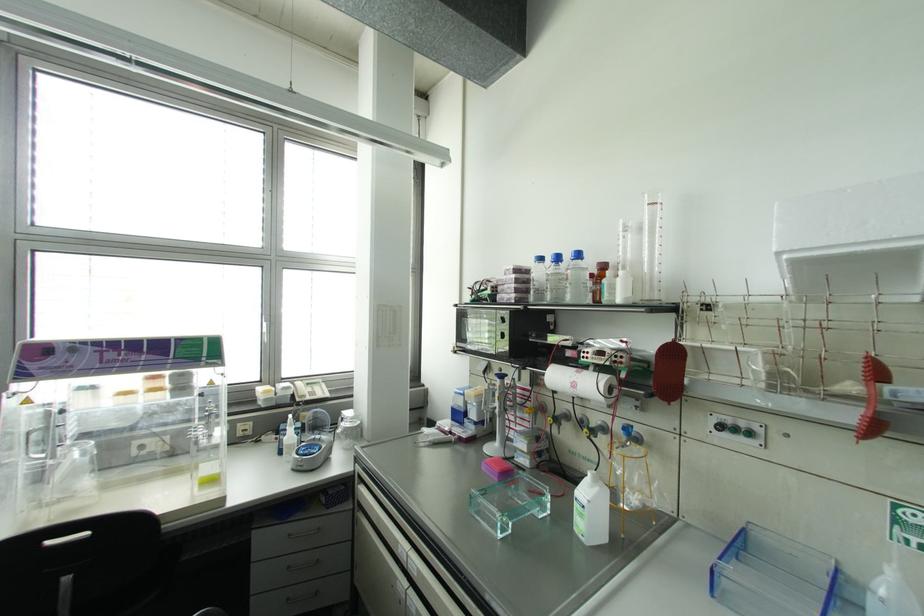
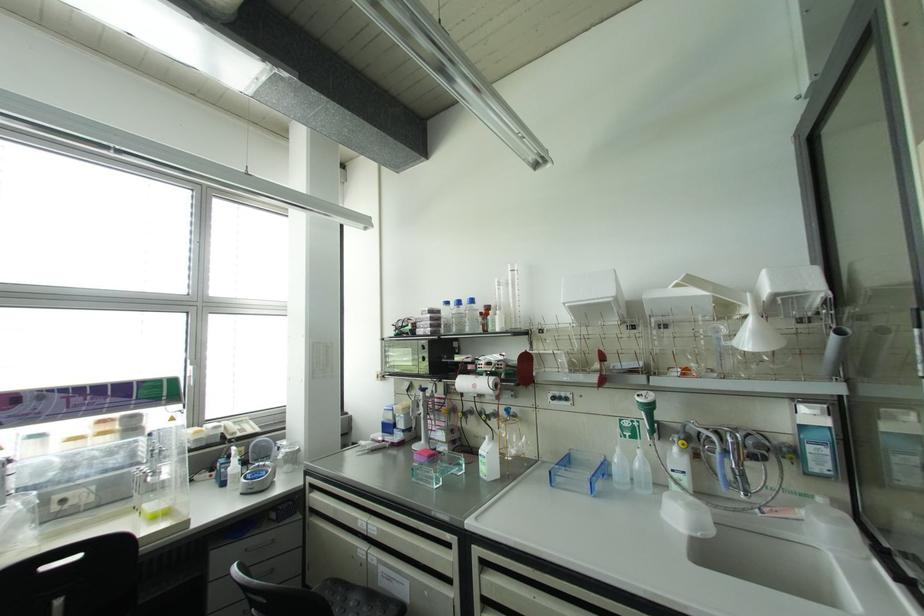
Where in the second image is the point corresponding to point (574, 384) from the first image?

(473, 386)